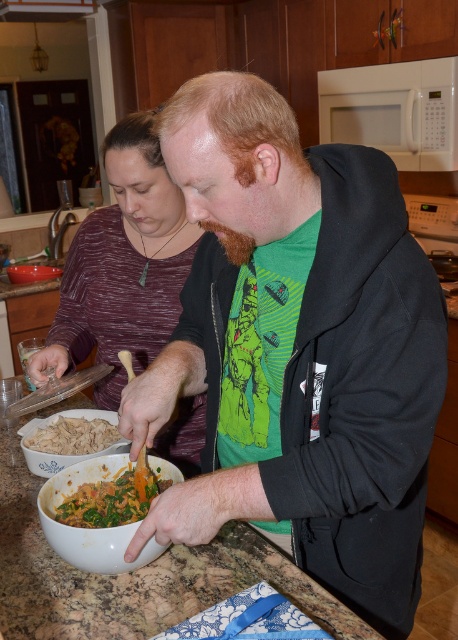
Which is below, green matte shirt at center or chopped green vegetables at center?

chopped green vegetables at center

Does green matte shirt at center have a greater width compared to chopped green vegetables at center?

Correct, the width of green matte shirt at center exceeds that of chopped green vegetables at center.

Who is more forward, (403,593) or (148,474)?

Point (403,593) is more forward.

Where is `green matte shirt at center`? green matte shirt at center is located at coordinates (298, 348).

Can you confirm if matte white bowl at center is wider than white matte bowl at lower left?

Yes, matte white bowl at center is wider than white matte bowl at lower left.

Can you confirm if matte white bowl at center is positioned to the left of white matte bowl at lower left?

In fact, matte white bowl at center is to the right of white matte bowl at lower left.

Based on the photo, who is more distant from viewer, (55, 497) or (59, 269)?

Point (59, 269)

Locate an element on the screen. The image size is (458, 640). matte white bowl at center is located at coordinates (74, 492).

Between point (185, 467) and point (112, 504), which one is positioned behind?

The point (185, 467) is more distant.

Who is shorter, maroon sweater at center or chopped green vegetables at center?

With less height is chopped green vegetables at center.

Measure the distance between point (169, 326) and camera.

Point (169, 326) and camera are 4.96 feet apart.

Find the location of a particular element. The image size is (458, 640). maroon sweater at center is located at coordinates pyautogui.click(x=124, y=260).